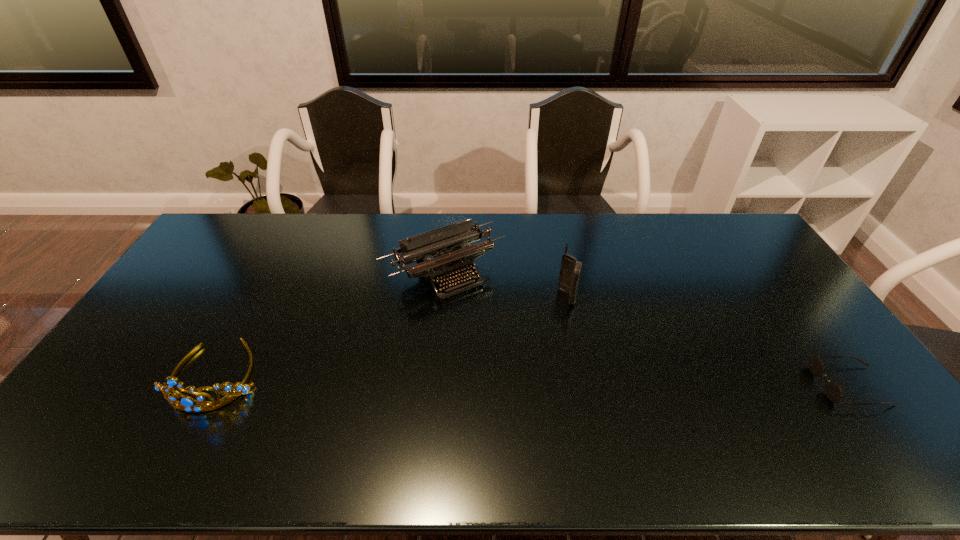
You are a GUI agent. You are given a task and a screenshot of the screen. Output one action in this format:
    pyautogui.click(x=<x>, y=<y>)
    Task: Click on the leftmost object
    The image size is (960, 540).
    Given the screenshot: What is the action you would take?
    pyautogui.click(x=185, y=403)

Image resolution: width=960 pixels, height=540 pixels. Identify the location of the rightmost object. (834, 392).

The width and height of the screenshot is (960, 540). I want to click on the shortest object, so click(x=834, y=392).

Locate an element on the screen. Image resolution: width=960 pixels, height=540 pixels. typewriter is located at coordinates (453, 255).

Locate an element on the screen. the tallest object is located at coordinates (570, 270).

Where is `cellular telephone`? The image size is (960, 540). cellular telephone is located at coordinates (570, 270).

Image resolution: width=960 pixels, height=540 pixels. What are the coordinates of `vacant region located 0.350m on the front-facing side of the shortest object` in the screenshot? It's located at (686, 385).

This screenshot has width=960, height=540. Identify the location of free space located 0.120m on the front-facing side of the shortest object. (773, 385).

The height and width of the screenshot is (540, 960). In order to click on free space located 0.340m on the front-facing side of the shortest object in this screenshot , I will do `click(690, 385)`.

Where is `vacant space located on the typing side of the third object from right to left`? Image resolution: width=960 pixels, height=540 pixels. vacant space located on the typing side of the third object from right to left is located at coordinates (505, 341).